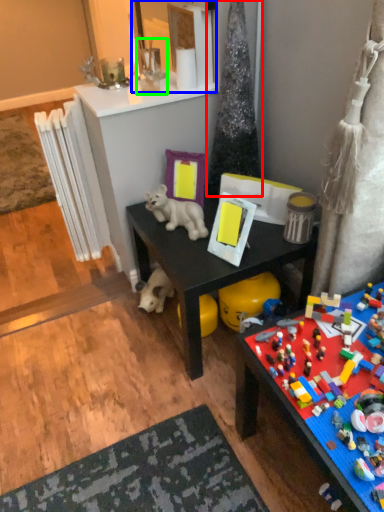
Question: Which object is positioned farthest from christmas tree (highlighted by a red box)? Select from mirror (highlighted by a blue box) and toy (highlighted by a green box).

Choices:
 (A) mirror
 (B) toy

Answer: (B)